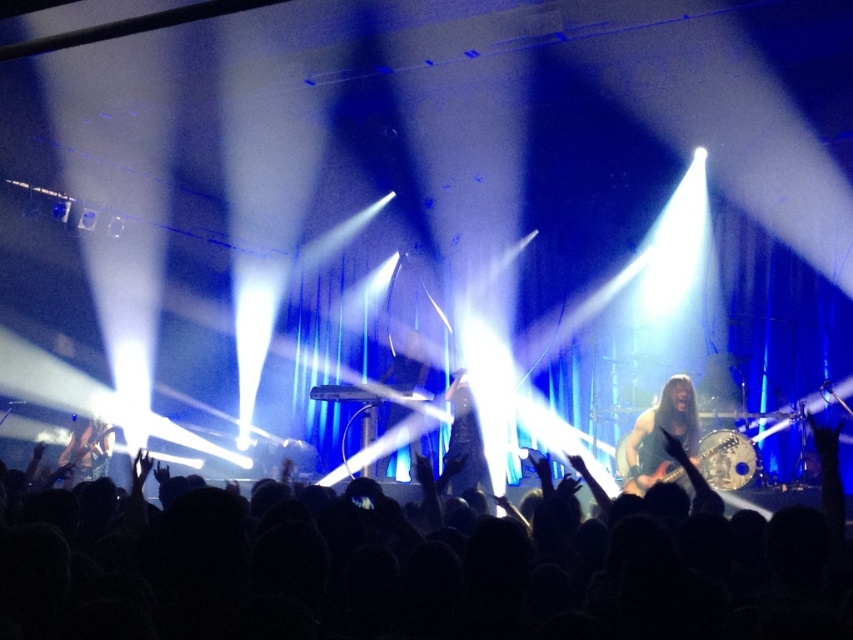
You are a stagehand who needs to pick up the shiny metallic guitar at center. You are currently standing 6 meters away from it. Can you reach it without moving closer?

The shiny metallic guitar at center and viewer are 5.80 meters apart, so you are 0.20 meters closer than your current position of 6 meters. Therefore, you can reach it without moving closer.

You are a stagehand needing to place a new spotlight. The spotlight can only cover objects that take up more space. Which object should you aim it at between the black leather jacket at center and the shiny black guitar at left?

The shiny black guitar at left occupies more space than the black leather jacket at center, so the spotlight should be aimed at the shiny black guitar at left.

You are standing in the front row of the concert. You want to grab the shiny metallic guitar at center during the encore. Considering your height is 5 feet 6 inches, can you reach it?

The shiny metallic guitar at center is 19.02 feet from viewer, so you cannot reach it from the front row as it is too far away.